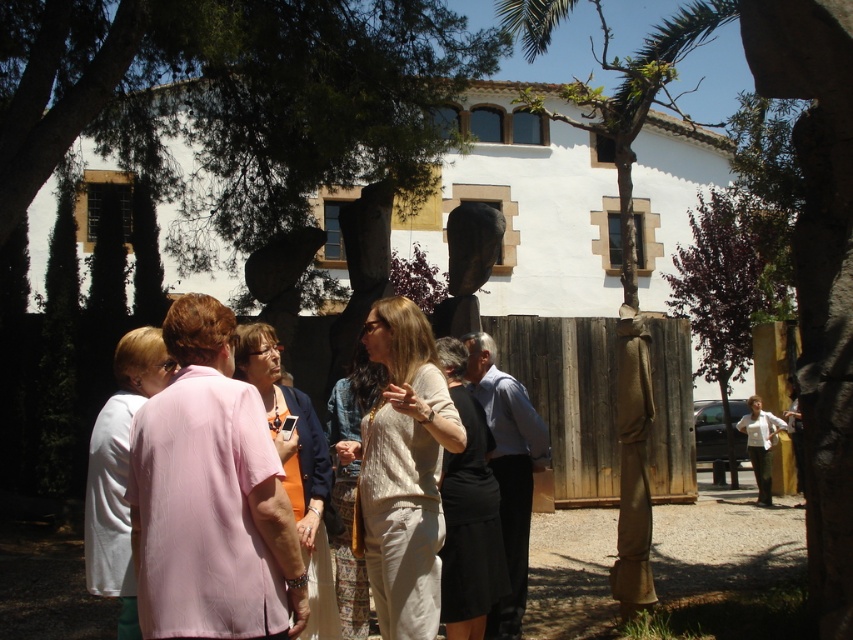
Which is in front, point (737, 320) or point (477, 252)?

Point (477, 252) is in front.

Between purple leafy tree at right and black stone sculpture at center, which one is positioned lower?

black stone sculpture at center is lower down.

You are a GUI agent. You are given a task and a screenshot of the screen. Output one action in this format:
    pyautogui.click(x=<x>, y=<y>)
    Task: Click on the purple leafy tree at right
    This screenshot has width=853, height=640.
    Given the screenshot: What is the action you would take?
    pyautogui.click(x=730, y=284)

Is brown wooden tree at center closer to the viewer compared to purple leafy tree at right?

Yes.

Is brown wooden tree at center behind purple leafy tree at right?

No, it is not.

Is point (646, 381) less distant than point (759, 310)?

Yes, point (646, 381) is closer to viewer.

You are a GUI agent. You are given a task and a screenshot of the screen. Output one action in this format:
    pyautogui.click(x=<x>, y=<y>)
    Task: Click on the brown wooden tree at center
    The image size is (853, 640).
    Given the screenshot: What is the action you would take?
    pyautogui.click(x=634, y=259)

Is brown wooden tree at center to the left of black stone sculpture at center from the viewer's perspective?

Incorrect, brown wooden tree at center is not on the left side of black stone sculpture at center.

Does brown wooden tree at center have a greater width compared to black stone sculpture at center?

Yes, brown wooden tree at center is wider than black stone sculpture at center.

Describe the element at coordinates (634, 259) in the screenshot. This screenshot has height=640, width=853. I see `brown wooden tree at center` at that location.

Identify the location of brown wooden tree at center. (634, 259).